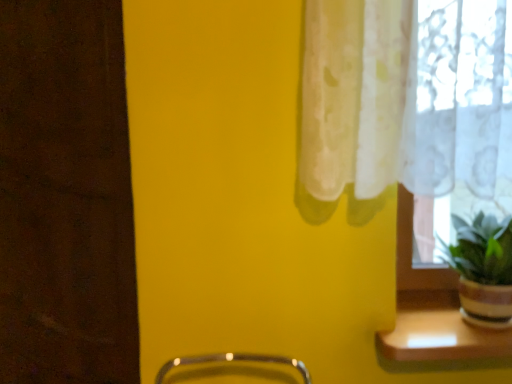
Question: Does wooden shelf at lower right have a greater width compared to green matte plant at right?

Choices:
 (A) yes
 (B) no

Answer: (B)

Question: Is wooden shelf at lower right bigger than green matte plant at right?

Choices:
 (A) yes
 (B) no

Answer: (B)

Question: Can you confirm if wooden shelf at lower right is positioned to the right of green matte plant at right?

Choices:
 (A) yes
 (B) no

Answer: (B)

Question: Can you confirm if wooden shelf at lower right is thinner than green matte plant at right?

Choices:
 (A) yes
 (B) no

Answer: (A)

Question: Could you tell me if wooden shelf at lower right is turned towards green matte plant at right?

Choices:
 (A) yes
 (B) no

Answer: (B)

Question: From a real-world perspective, is wooden shelf at lower right located beneath green matte plant at right?

Choices:
 (A) no
 (B) yes

Answer: (B)

Question: Can you confirm if green matte plant at right is shorter than wooden shelf at lower right?

Choices:
 (A) yes
 (B) no

Answer: (B)

Question: From a real-world perspective, is green matte plant at right physically above wooden shelf at lower right?

Choices:
 (A) no
 (B) yes

Answer: (B)

Question: Does green matte plant at right turn towards wooden shelf at lower right?

Choices:
 (A) yes
 (B) no

Answer: (B)

Question: Considering the relative positions of green matte plant at right and wooden shelf at lower right in the image provided, is green matte plant at right to the right of wooden shelf at lower right from the viewer's perspective?

Choices:
 (A) no
 (B) yes

Answer: (B)

Question: Is green matte plant at right not near wooden shelf at lower right?

Choices:
 (A) yes
 (B) no

Answer: (B)

Question: Does green matte plant at right come in front of wooden shelf at lower right?

Choices:
 (A) no
 (B) yes

Answer: (B)

Question: From their relative heights in the image, would you say wooden shelf at lower right is taller or shorter than green matte plant at right?

Choices:
 (A) short
 (B) tall

Answer: (A)